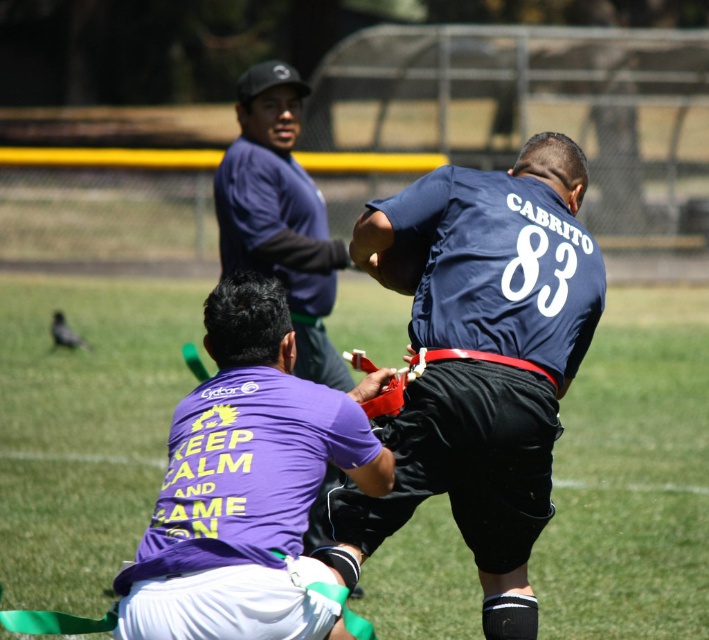
Question: Does navy blue jersey at center have a greater width compared to matte blue jersey at upper center?

Choices:
 (A) no
 (B) yes

Answer: (B)

Question: Which object appears closest to the camera in this image?

Choices:
 (A) purple fabric shirt at center
 (B) matte blue jersey at upper center
 (C) purple matte shirt at center

Answer: (C)

Question: Does purple fabric shirt at center come in front of matte blue jersey at upper center?

Choices:
 (A) no
 (B) yes

Answer: (A)

Question: Can you confirm if navy blue jersey at center is smaller than matte blue jersey at upper center?

Choices:
 (A) yes
 (B) no

Answer: (B)

Question: Which point appears closest to the camera in this image?

Choices:
 (A) (296, 252)
 (B) (608, 438)
 (C) (267, 365)
 (D) (445, 268)

Answer: (C)

Question: Among these points, which one is nearest to the camera?

Choices:
 (A) (442, 291)
 (B) (367, 301)

Answer: (A)